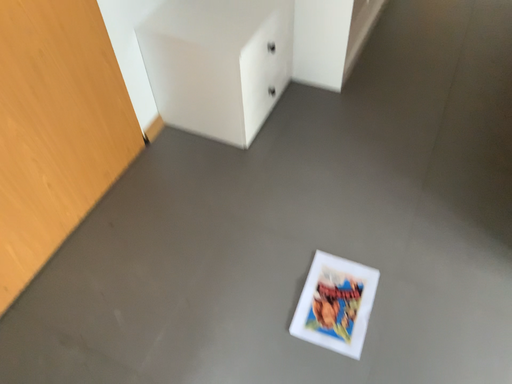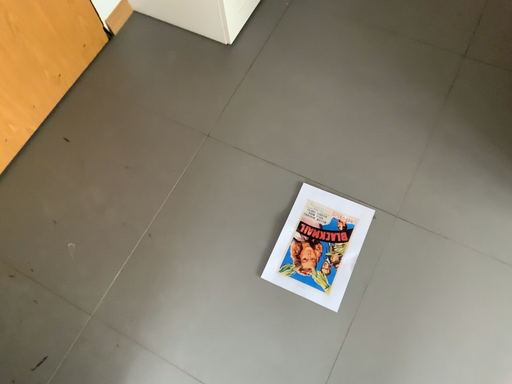
Question: Which way did the camera rotate in the video?

Choices:
 (A) rotated downward
 (B) rotated upward

Answer: (A)